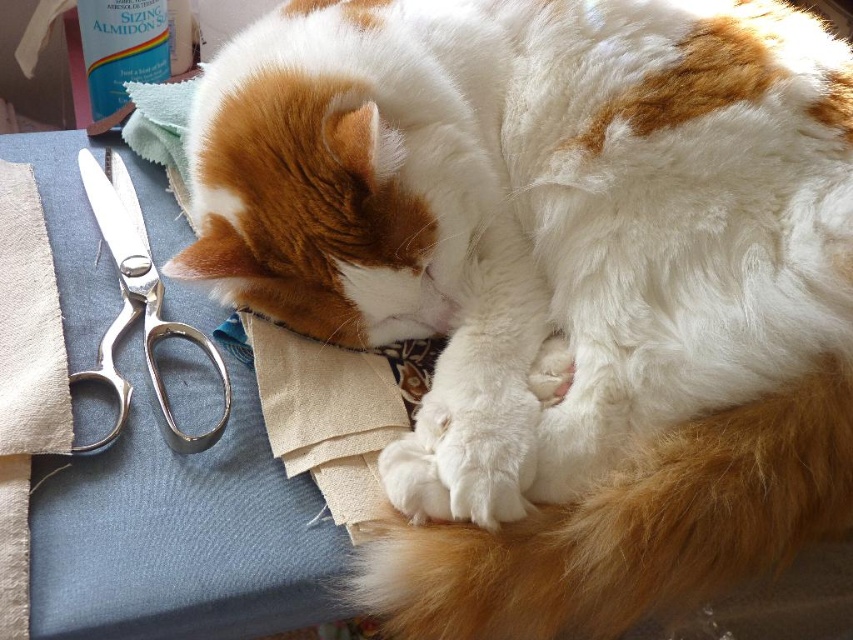
Question: Is white fur at lower right to the left of silver metallic scissors at left from the viewer's perspective?

Choices:
 (A) yes
 (B) no

Answer: (B)

Question: Observing the image, what is the correct spatial positioning of white fur at lower right in reference to silver metallic scissors at left?

Choices:
 (A) above
 (B) below

Answer: (B)

Question: Considering the relative positions of white fur at lower right and silver metallic scissors at left in the image provided, where is white fur at lower right located with respect to silver metallic scissors at left?

Choices:
 (A) right
 (B) left

Answer: (A)